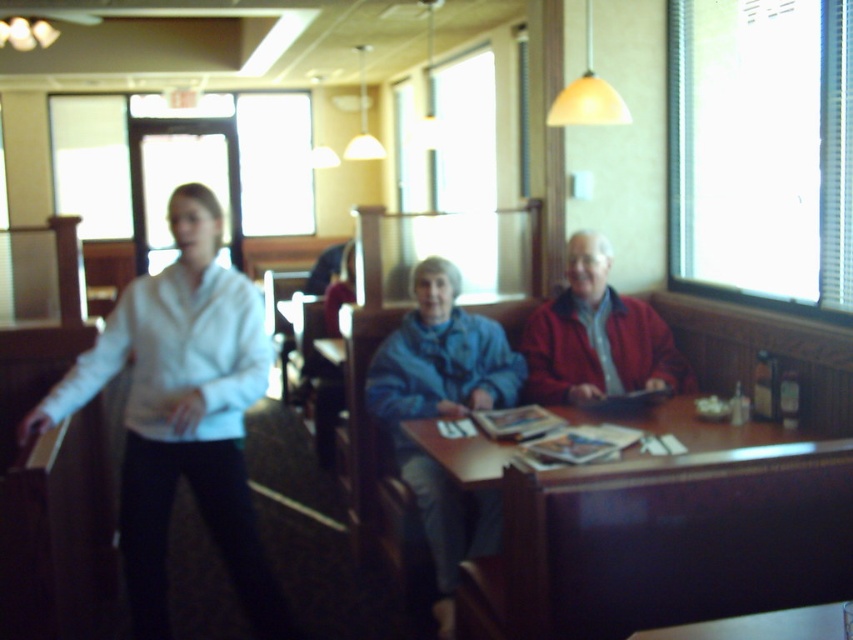
Does wooden table at center have a smaller size compared to blue fleece jacket at center?

Correct, wooden table at center occupies less space than blue fleece jacket at center.

Image resolution: width=853 pixels, height=640 pixels. What are the coordinates of `wooden table at center` in the screenshot? It's located at (656, 528).

Where is `wooden table at center`? This screenshot has width=853, height=640. wooden table at center is located at coordinates (656, 528).

Which of these two, white matte shirt at left or blue fleece jacket at center, stands taller?

Standing taller between the two is white matte shirt at left.

Can you confirm if white matte shirt at left is bigger than blue fleece jacket at center?

Indeed, white matte shirt at left has a larger size compared to blue fleece jacket at center.

Which is in front, point (212, 220) or point (451, 534)?

Point (212, 220)

The height and width of the screenshot is (640, 853). I want to click on white matte shirt at left, so click(x=183, y=413).

Between white matte shirt at left and red matte jacket at center, which one is positioned higher?

red matte jacket at center is above.

Describe the element at coordinates (183, 413) in the screenshot. I see `white matte shirt at left` at that location.

Identify the location of white matte shirt at left. The height and width of the screenshot is (640, 853). (183, 413).